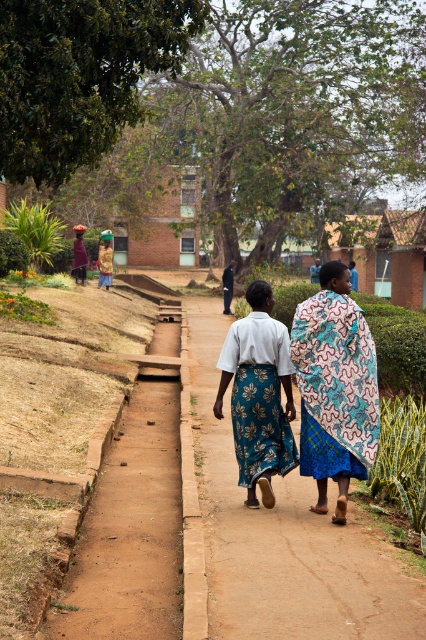
You are standing at point (131, 528) in the image. What is the terrain here?

The terrain at point (131, 528) is brown dirt path at lower left.

You are standing at the point labeled point (175, 381) and want to walk towards the point labeled point (339, 579). Given the narrow, unpaved pathway flanked by grassy areas, can you safely move forward without stepping off the path?

Yes, you can safely move forward because point (339, 579) is in front of point (175, 381), indicating the direction of travel is along the pathway towards the desired point.

You are a photographer trying to capture a photo of the patterned fabric dress at center. You notice the brown dirt path at lower left might be distracting. Can you adjust your camera angle to frame the dress without showing the path?

The brown dirt path at lower left is located below the patterned fabric dress at center, so by adjusting the camera angle to focus higher on the dress, you can exclude the path from the frame.